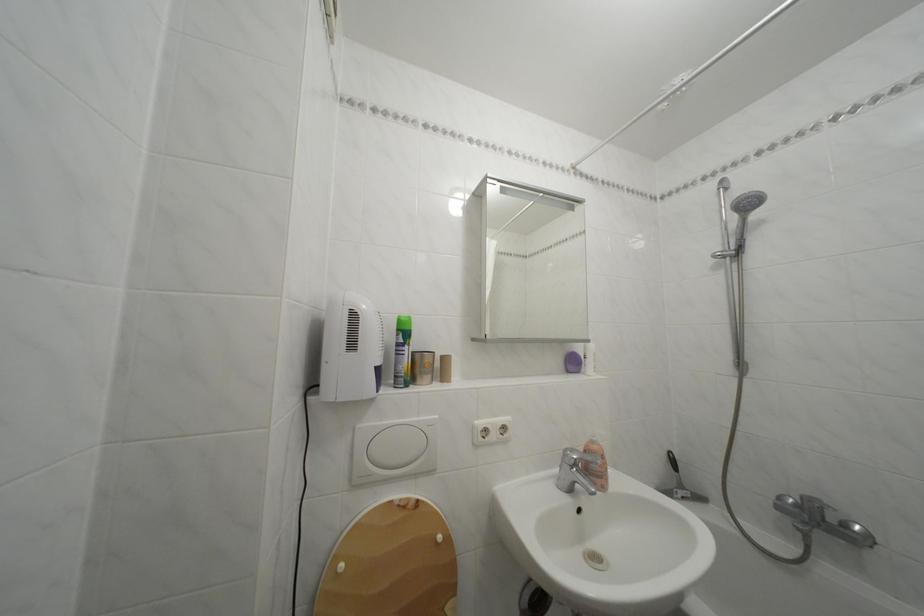
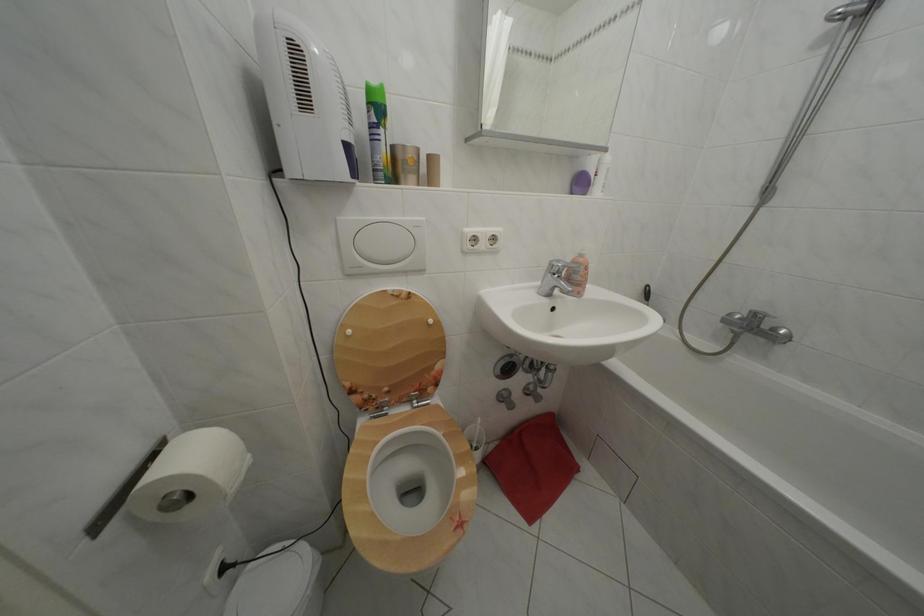
In the second image, find the point that corresponds to the point at 854,531 in the first image.

(783, 336)